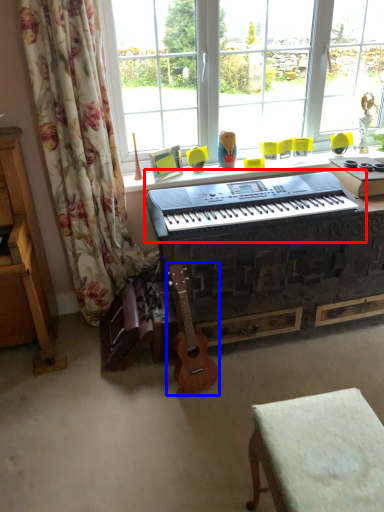
Question: Among these objects, which one is farthest to the camera, musical keyboard (highlighted by a red box) or guitar (highlighted by a blue box)?

Choices:
 (A) musical keyboard
 (B) guitar

Answer: (B)